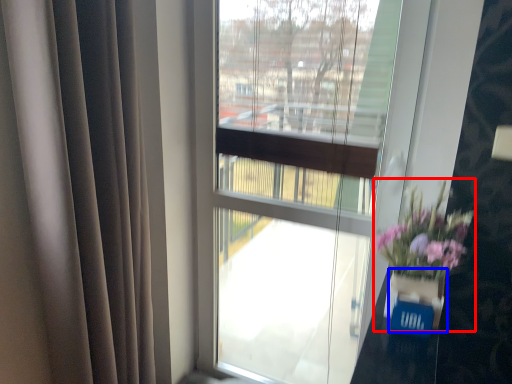
Question: Among these objects, which one is farthest to the camera, floral arrangement (highlighted by a red box) or glass vase (highlighted by a blue box)?

Choices:
 (A) floral arrangement
 (B) glass vase

Answer: (A)